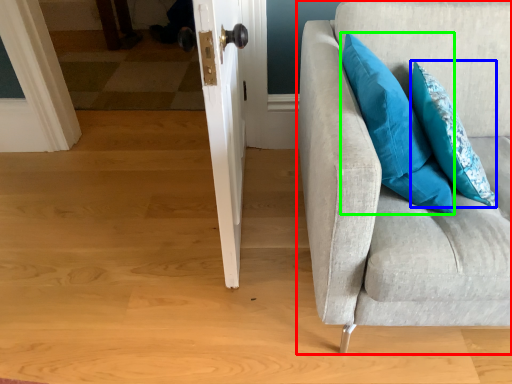
Question: Considering the real-world distances, which object is closest to studio couch (highlighted by a red box)? pillow (highlighted by a blue box) or pillow (highlighted by a green box).

Choices:
 (A) pillow
 (B) pillow

Answer: (B)